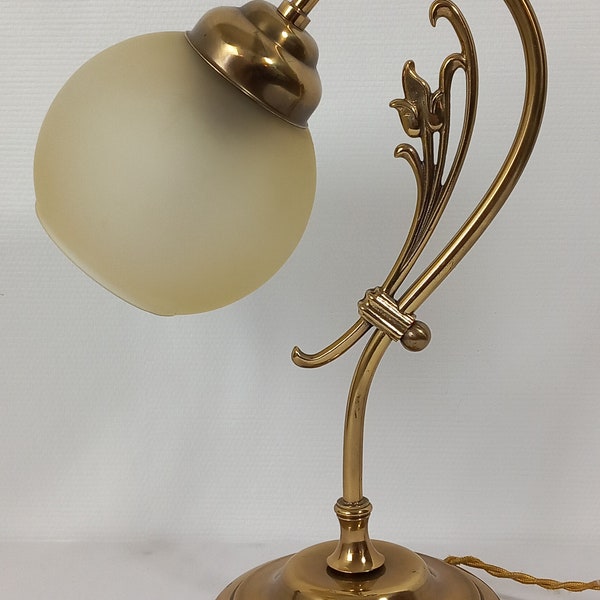
What are the coordinates of `below lamp` in the screenshot? It's located at (192, 594).